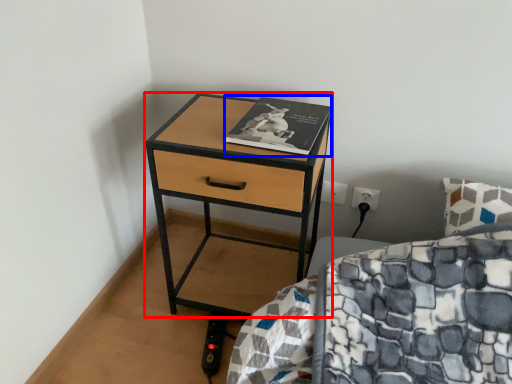
Question: Which of the following is the closest to the observer, nightstand (highlighted by a red box) or book (highlighted by a blue box)?

Choices:
 (A) nightstand
 (B) book

Answer: (A)